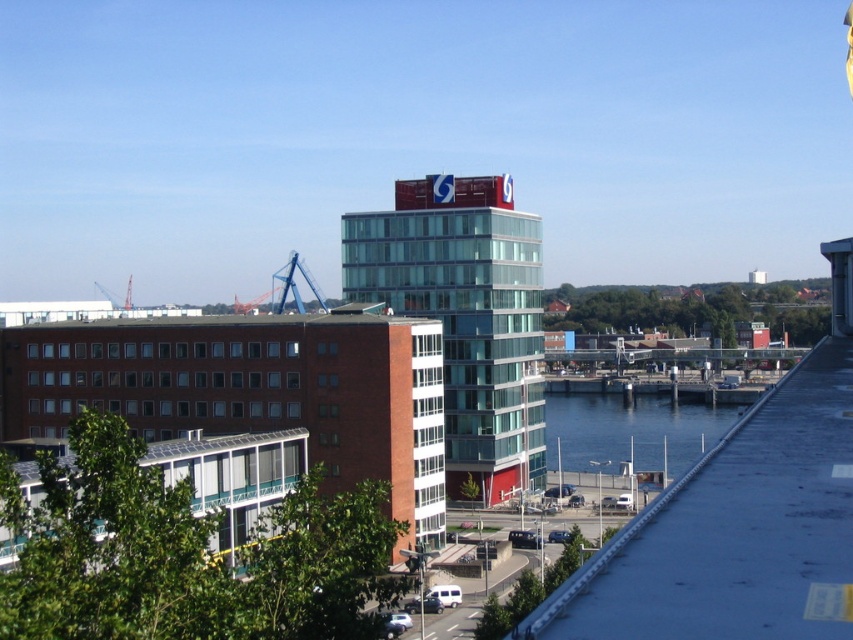
You are standing at the point labeled point (465, 316) in the image. What is the nearest object to you?

The nearest object to you is the glassy blue building at center, which is represented by the point (465, 316).

You are standing at the center of the pedestrian walkway in the urban landscape. You see two points marked on the ground ahead of you. The first point is at coordinates point (503, 316), and the second is at point (553, 474). Which point is closer to your current position?

Point (503, 316) is in front of point (553, 474), so it is closer to your current position on the pedestrian walkway.

You are an architect designing a new sculpture that will be placed between the glassy blue building at center and the blue water at lower center. The sculpture requires a minimum of 10 meters of space between them to be installed. Based on the scene, can you determine if there is enough space?

The glassy blue building at center is narrower than the blue water at lower center, but the exact distance between them isn